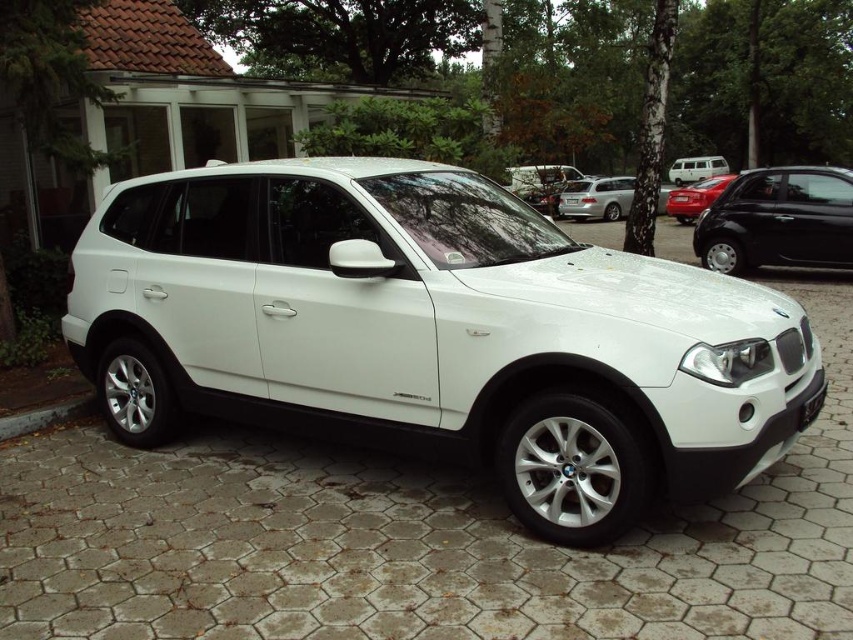
I want to click on shiny black car at right, so click(778, 220).

Does shiny black car at right have a lesser width compared to satin silver sedan at center?

No, shiny black car at right is not thinner than satin silver sedan at center.

Does shiny black car at right appear over satin silver sedan at center?

Actually, shiny black car at right is below satin silver sedan at center.

Is point (767, 257) closer to camera compared to point (576, 200)?

Yes.

Where is `shiny black car at right`? shiny black car at right is located at coordinates (778, 220).

Based on the photo, is white matte van at upper center above white plastic license plate at center?

Yes, white matte van at upper center is above white plastic license plate at center.

Who is positioned more to the left, white matte van at upper center or white plastic license plate at center?

Positioned to the left is white plastic license plate at center.

This screenshot has width=853, height=640. Describe the element at coordinates (695, 168) in the screenshot. I see `white matte van at upper center` at that location.

Where is `white matte van at upper center`? white matte van at upper center is located at coordinates (695, 168).